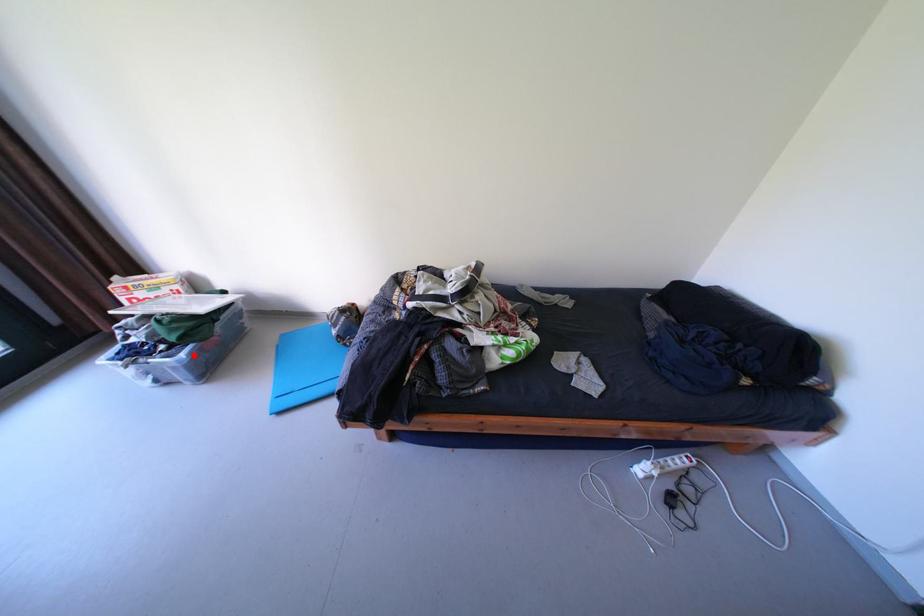
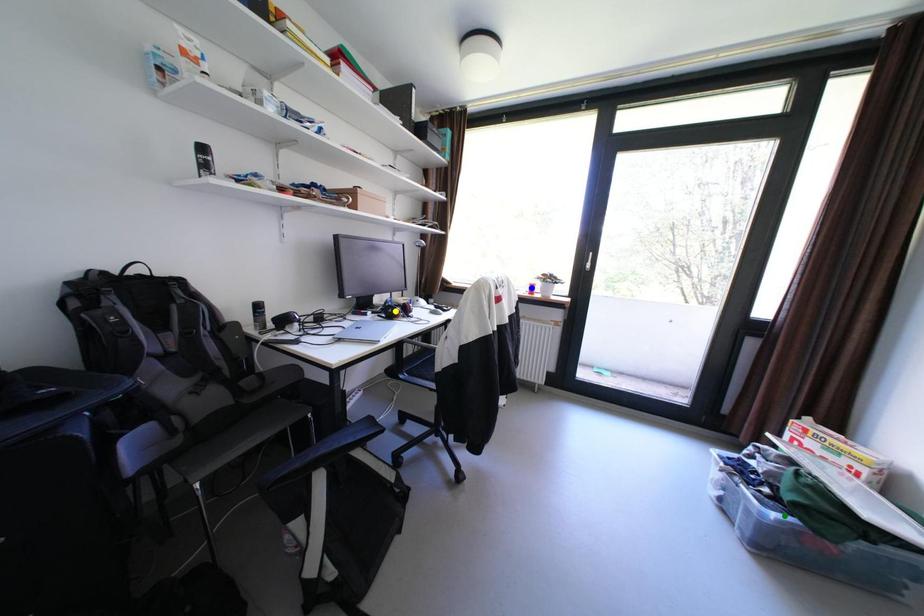
Question: I am providing you with two images of the same scene from different viewpoints. A red point is marked on the first image. You are given multiple points on the second image. Which mark in image 2 goes with the point in image 1?

Choices:
 (A) green point
 (B) blue point
 (C) yellow point

Answer: (A)